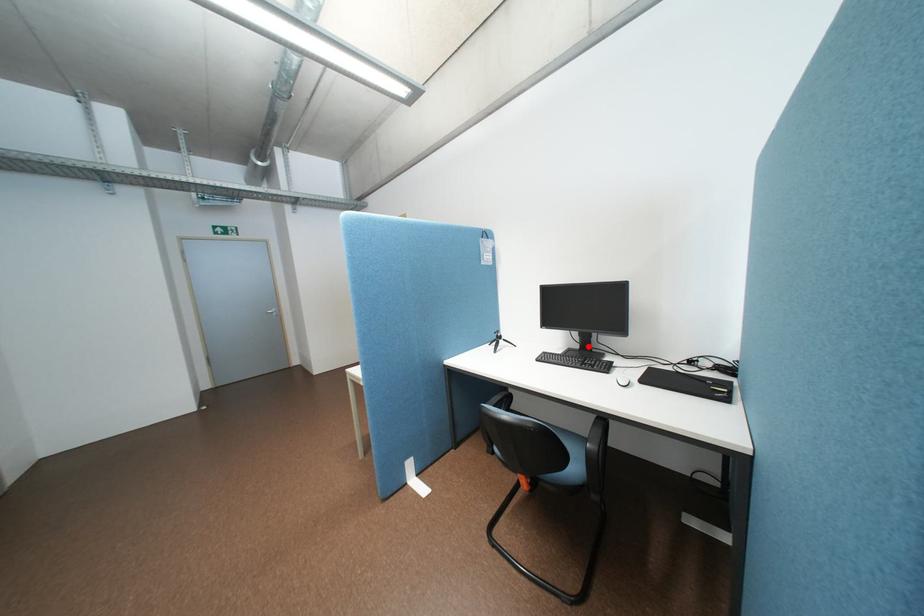
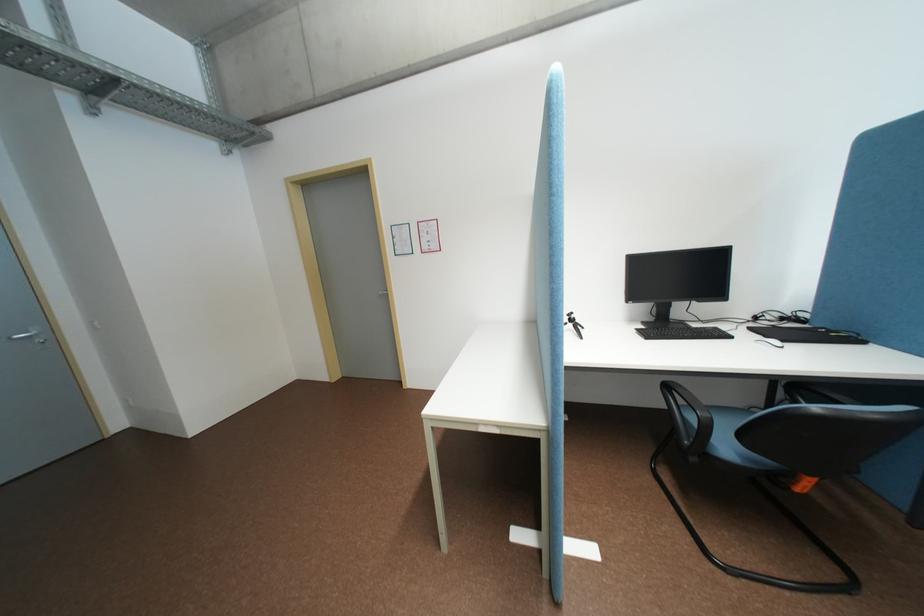
The point at the highlighted location is marked in the first image. Where is the corresponding point in the second image?

(662, 318)